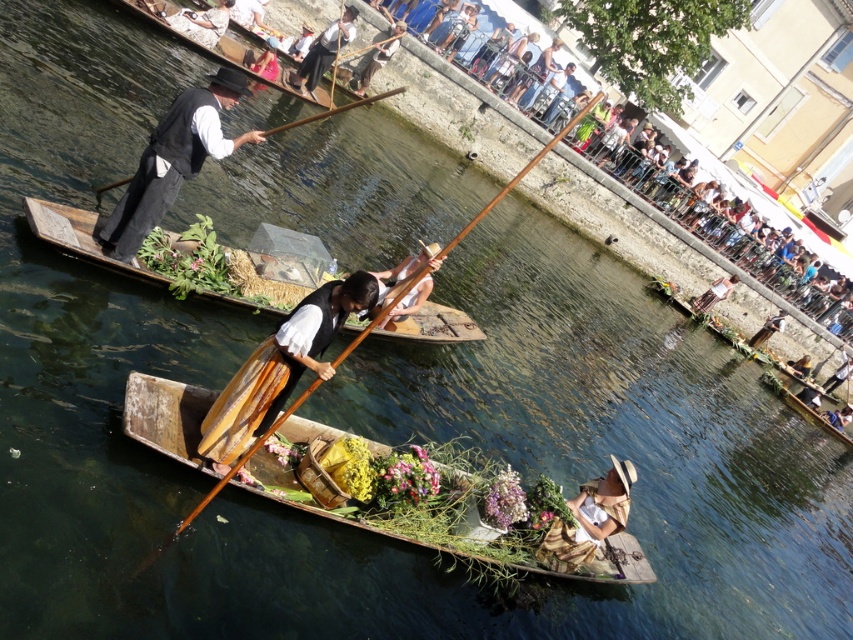
Identify the location of matte black vest at upper center. (323, 51).

Who is more distant from viewer, (x=352, y=6) or (x=276, y=58)?

The point (x=352, y=6) is behind.

The width and height of the screenshot is (853, 640). What do you see at coordinates (323, 51) in the screenshot? I see `matte black vest at upper center` at bounding box center [323, 51].

Where is `matte black vest at upper center`? The height and width of the screenshot is (640, 853). matte black vest at upper center is located at coordinates (323, 51).

This screenshot has height=640, width=853. What do you see at coordinates (589, 518) in the screenshot?
I see `camouflage fabric hat at lower right` at bounding box center [589, 518].

Based on the photo, is camouflage fabric hat at lower right smaller than wooden canoe at center?

Yes, camouflage fabric hat at lower right is smaller than wooden canoe at center.

Locate an element on the screen. The height and width of the screenshot is (640, 853). camouflage fabric hat at lower right is located at coordinates (589, 518).

Which is more to the right, matte black vest at center or matte black vest at upper left?

matte black vest at center is more to the right.

Locate an element on the screen. This screenshot has height=640, width=853. matte black vest at center is located at coordinates (280, 368).

The height and width of the screenshot is (640, 853). In order to click on matte black vest at center in this screenshot , I will do `click(280, 368)`.

Find the location of a particular element. matte black vest at center is located at coordinates (280, 368).